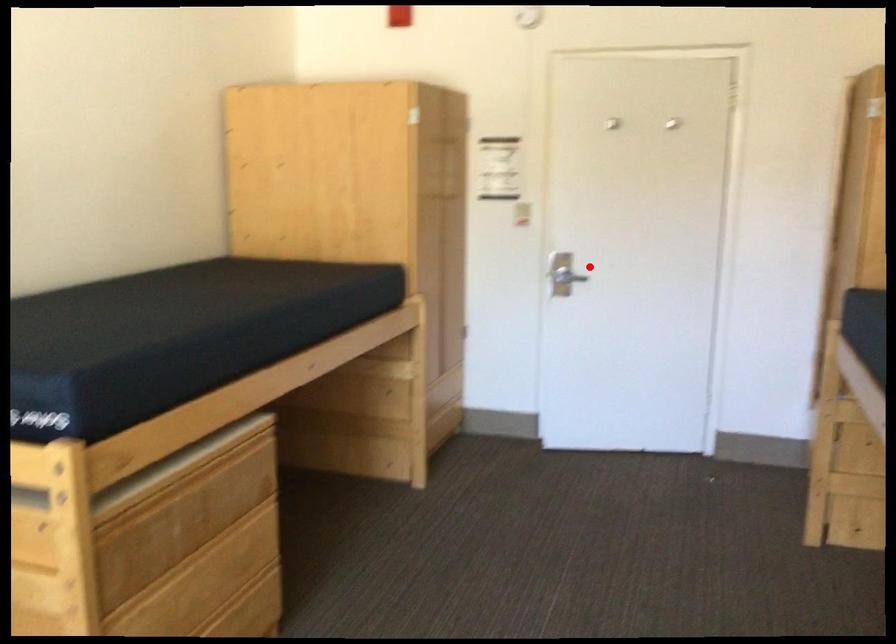
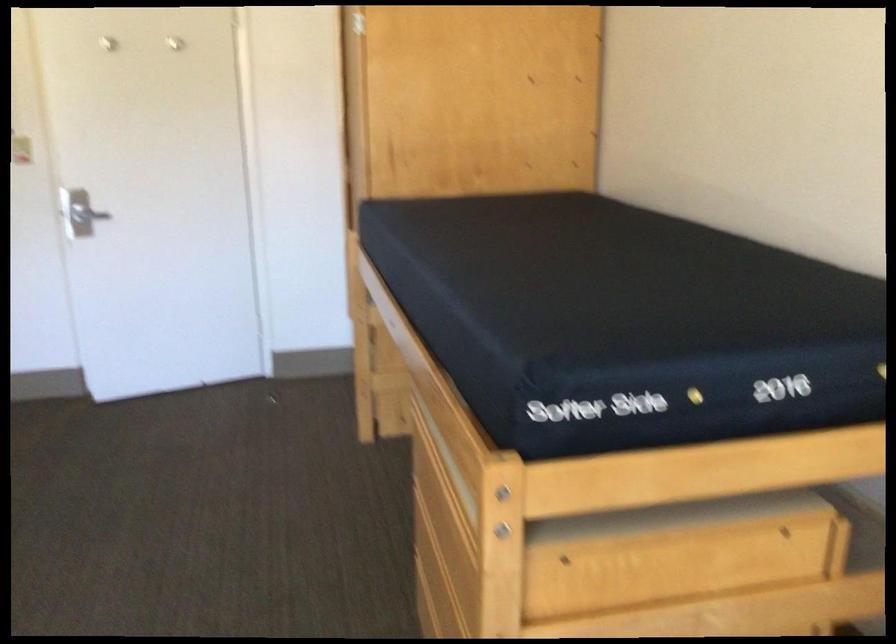
In the second image, find the point that corresponds to the highlighted location in the first image.

(87, 214)